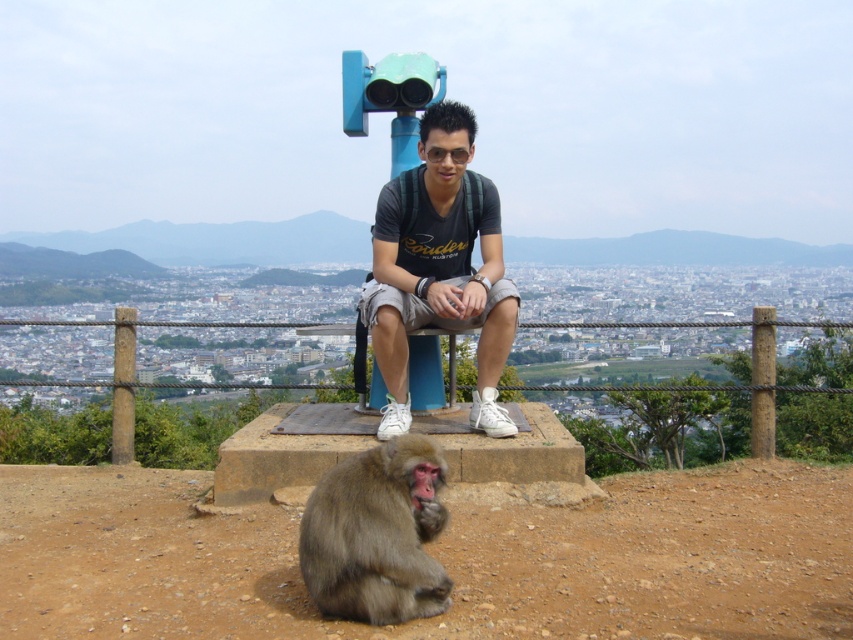
Question: Is matte black t-shirt at center further to camera compared to brown furry monkey at lower center?

Choices:
 (A) yes
 (B) no

Answer: (A)

Question: Can you confirm if matte black t-shirt at center is positioned below brown furry monkey at lower center?

Choices:
 (A) no
 (B) yes

Answer: (A)

Question: Is matte black t-shirt at center to the right of brown furry monkey at lower center from the viewer's perspective?

Choices:
 (A) yes
 (B) no

Answer: (A)

Question: Which object is farther from the camera taking this photo?

Choices:
 (A) matte black t-shirt at center
 (B) brown furry monkey at lower center

Answer: (A)